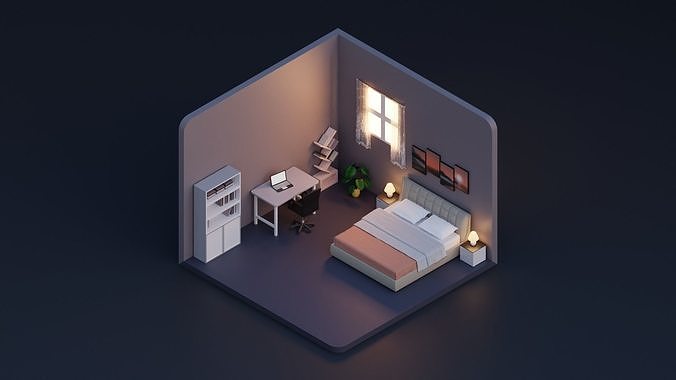
You are a GUI agent. You are given a task and a screenshot of the screen. Output one action in this format:
    pyautogui.click(x=<x>, y=<y>)
    Task: Click on the blanket
    The image size is (676, 380).
    Given the screenshot: What is the action you would take?
    pyautogui.click(x=378, y=233)